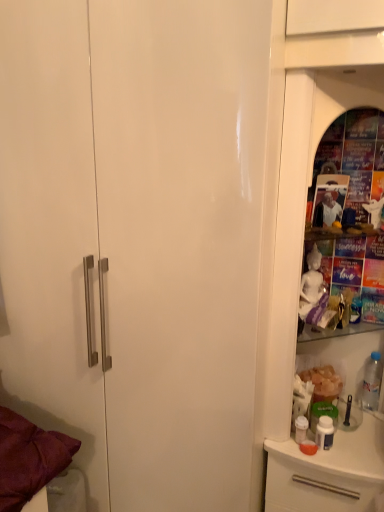
Question: Is white glossy dresser at right at the back of translucent plastic bottle at right?

Choices:
 (A) yes
 (B) no

Answer: (A)

Question: Is translucent plastic bottle at right bigger than white glossy dresser at right?

Choices:
 (A) no
 (B) yes

Answer: (A)

Question: From the image's perspective, does translucent plastic bottle at right appear lower than white glossy dresser at right?

Choices:
 (A) yes
 (B) no

Answer: (A)

Question: Is translucent plastic bottle at right completely or partially outside of white glossy dresser at right?

Choices:
 (A) yes
 (B) no

Answer: (B)

Question: Considering the relative sizes of translucent plastic bottle at right and white glossy dresser at right in the image provided, is translucent plastic bottle at right taller than white glossy dresser at right?

Choices:
 (A) no
 (B) yes

Answer: (A)

Question: Is translucent plastic bottle at right at the left side of white glossy dresser at right?

Choices:
 (A) yes
 (B) no

Answer: (B)

Question: Is white glossy dresser at right directly adjacent to translucent plastic bottle at right?

Choices:
 (A) yes
 (B) no

Answer: (B)

Question: Can translucent plastic bottle at right be found inside white glossy dresser at right?

Choices:
 (A) yes
 (B) no

Answer: (A)

Question: From the image's perspective, is white glossy dresser at right located above translucent plastic bottle at right?

Choices:
 (A) yes
 (B) no

Answer: (A)

Question: Can you confirm if white glossy dresser at right is taller than translucent plastic bottle at right?

Choices:
 (A) no
 (B) yes

Answer: (B)

Question: Can you confirm if white glossy dresser at right is shorter than translucent plastic bottle at right?

Choices:
 (A) no
 (B) yes

Answer: (A)

Question: Considering the relative sizes of white glossy dresser at right and translucent plastic bottle at right in the image provided, is white glossy dresser at right thinner than translucent plastic bottle at right?

Choices:
 (A) no
 (B) yes

Answer: (A)

Question: Would you say white glossy dresser at right is inside or outside translucent plastic bottle at right?

Choices:
 (A) outside
 (B) inside

Answer: (A)